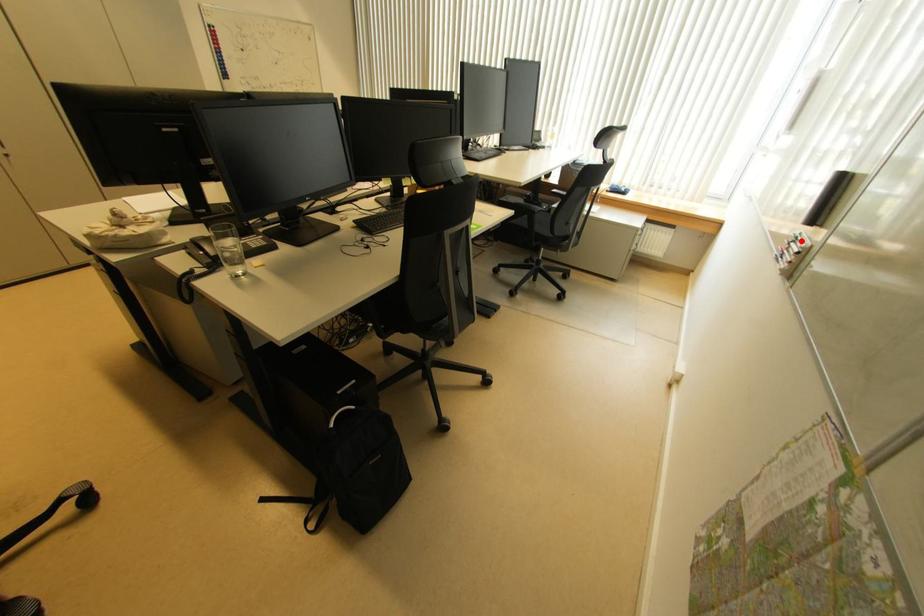
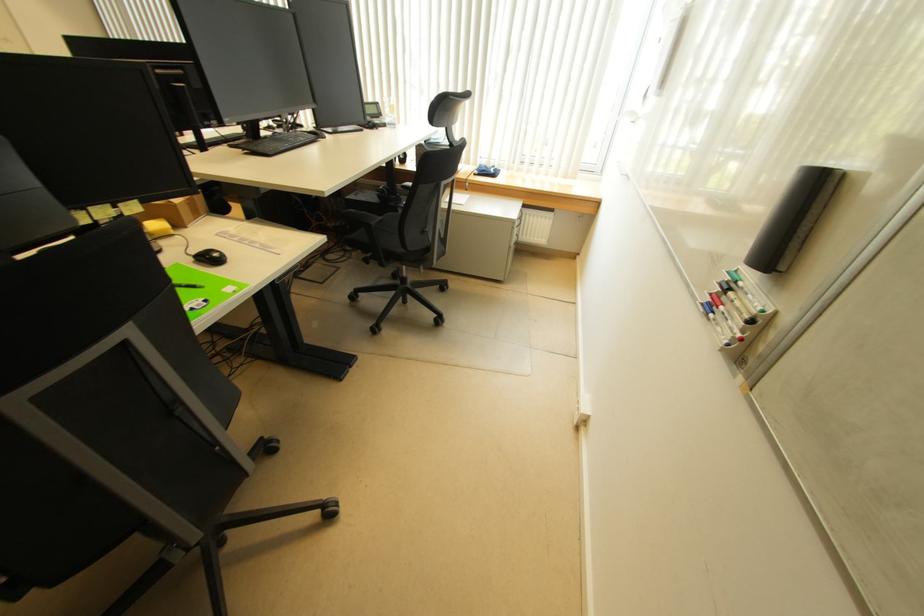
Where in the second image is the point corresponding to the highlighted location from the first image?

(743, 286)